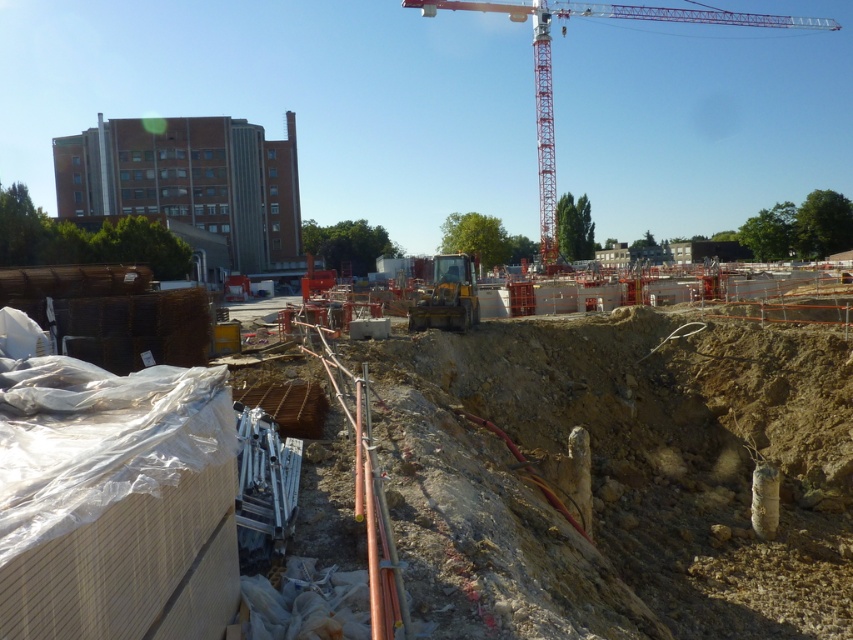
You are a construction worker who needs to move a heavy tool from the brown dirt at center to the red metallic crane at upper center. Which direction should you move the tool to reach the crane?

The brown dirt at center is to the left of the red metallic crane at upper center, so you should move the tool to the right to reach the crane.

You are a construction worker who needs to place a 2.5 meter tall safety sign. The sign must be placed where it can be seen above the brown dirt at center. Is the red metallic crane at upper center tall enough to support the sign so it can be seen over the dirt?

The red metallic crane at upper center is taller than the brown dirt at center. Since the crane is taller, placing the 2.5 meter tall safety sign on it would allow it to be visible above the brown dirt at center.